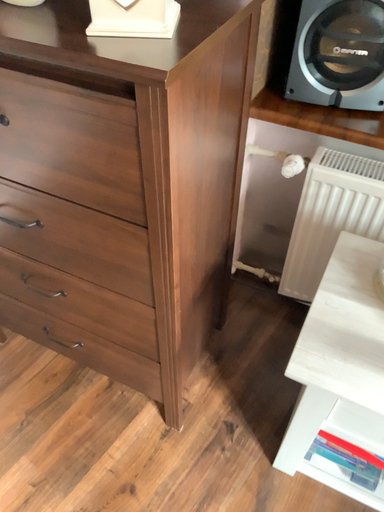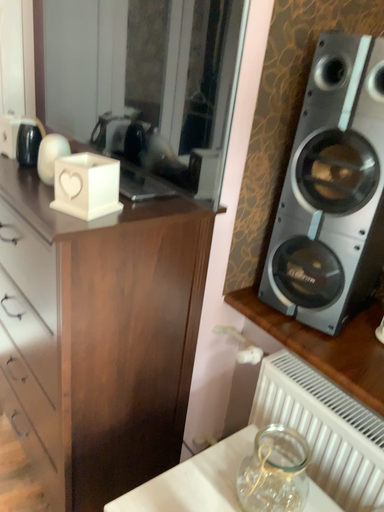
Question: Which way did the camera rotate in the video?

Choices:
 (A) rotated downward
 (B) rotated upward

Answer: (B)